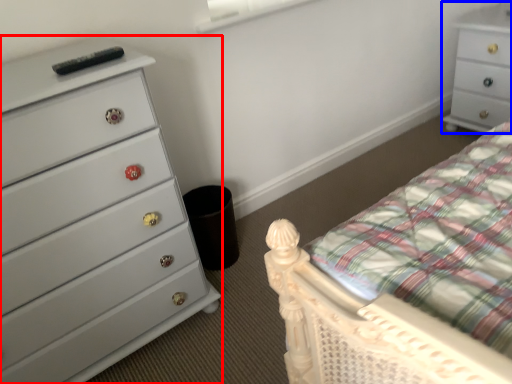
Question: Which point is further to the camera, chest of drawers (highlighted by a red box) or chest of drawers (highlighted by a blue box)?

Choices:
 (A) chest of drawers
 (B) chest of drawers

Answer: (B)